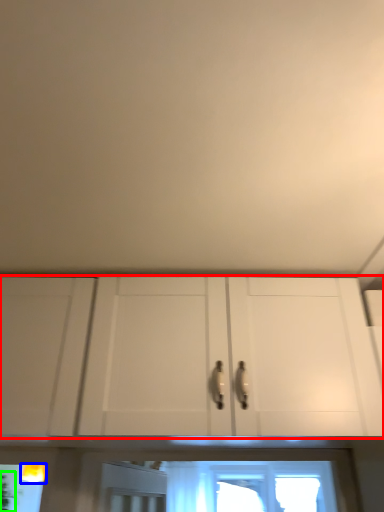
Question: Which object is positioned closest to cabinetry (highlighted by a red box)? Select from light fixture (highlighted by a blue box) and plant (highlighted by a green box).

Choices:
 (A) light fixture
 (B) plant

Answer: (A)